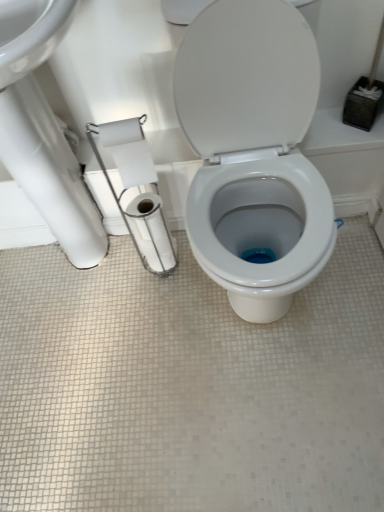
Question: Considering the positions of white matte toilet paper at left, the second toilet paper in the front-to-back sequence, and white glossy toilet at center in the image, is white matte toilet paper at left, the second toilet paper in the front-to-back sequence, wider or thinner than white glossy toilet at center?

Choices:
 (A) thin
 (B) wide

Answer: (A)

Question: Is point (117, 138) positioned closer to the camera than point (208, 89)?

Choices:
 (A) closer
 (B) farther

Answer: (A)

Question: Based on their relative distances, which object is nearer to the white paper at left, arranged as the first toilet paper when viewed from the front?

Choices:
 (A) white glossy toilet at center
 (B) white glossy sink at upper left
 (C) white matte toilet paper at left, the second toilet paper in the front-to-back sequence
 (D) white glossy toilet paper at center, arranged as the first toilet paper when viewed from the back

Answer: (D)

Question: Estimate the real-world distances between objects in this image. Which object is farther from the white matte toilet paper at left, which is counted as the second toilet paper, starting from the back?

Choices:
 (A) white glossy sink at upper left
 (B) white glossy toilet at center
 (C) white paper at left, arranged as the third toilet paper when viewed from the back
 (D) white glossy toilet paper at center, arranged as the first toilet paper when viewed from the back

Answer: (B)